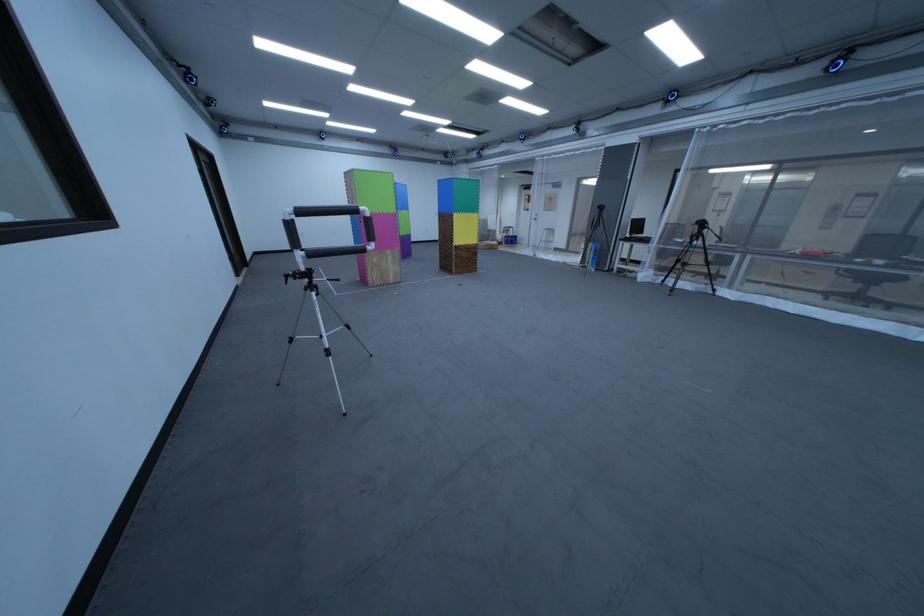
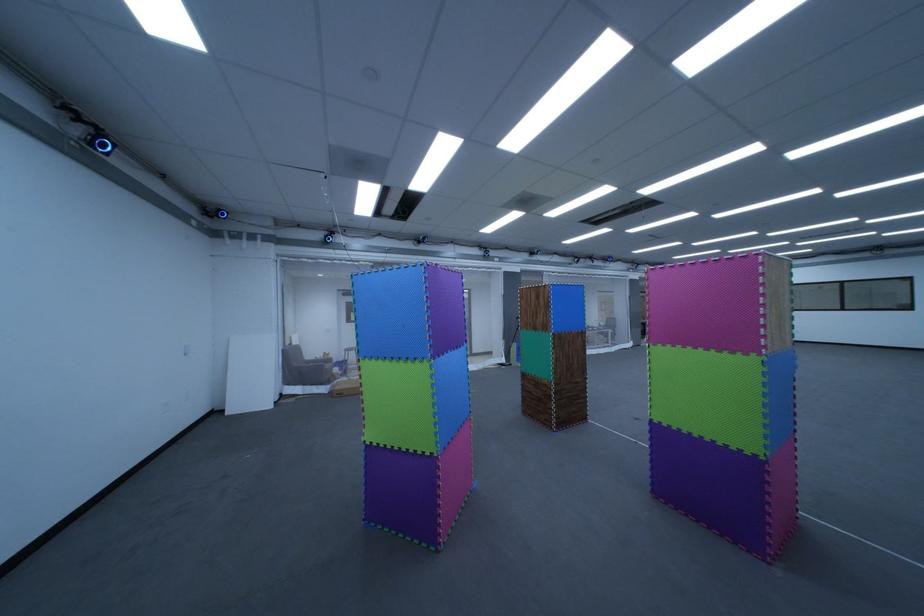
In the second image, find the point that corresponds to (541,190) in the first image.

(359, 296)